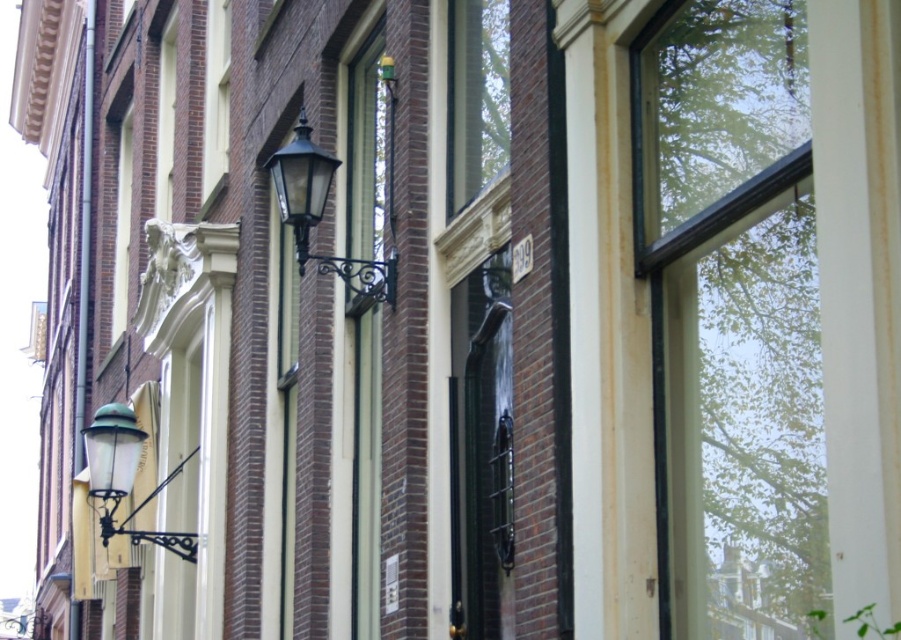
Question: Considering the relative positions of matte black lantern at upper center and green glass lamp at upper left in the image provided, where is matte black lantern at upper center located with respect to green glass lamp at upper left?

Choices:
 (A) above
 (B) below

Answer: (A)

Question: Can you confirm if matte black lantern at upper center is positioned to the left of green glass lamp at upper left?

Choices:
 (A) yes
 (B) no

Answer: (B)

Question: Can you confirm if matte black lantern at upper center is thinner than green glass lamp at upper left?

Choices:
 (A) yes
 (B) no

Answer: (A)

Question: Among these points, which one is farthest from the camera?

Choices:
 (A) (332, 173)
 (B) (126, 486)

Answer: (B)